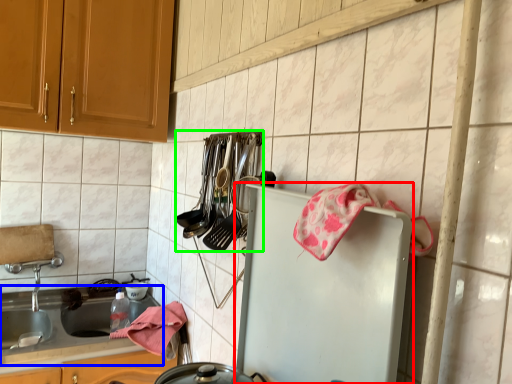
Question: Which object is positioned farthest from refrigerator (highlighted by a red box)? Select from countertop (highlighted by a blue box) and silverware (highlighted by a green box).

Choices:
 (A) countertop
 (B) silverware

Answer: (A)